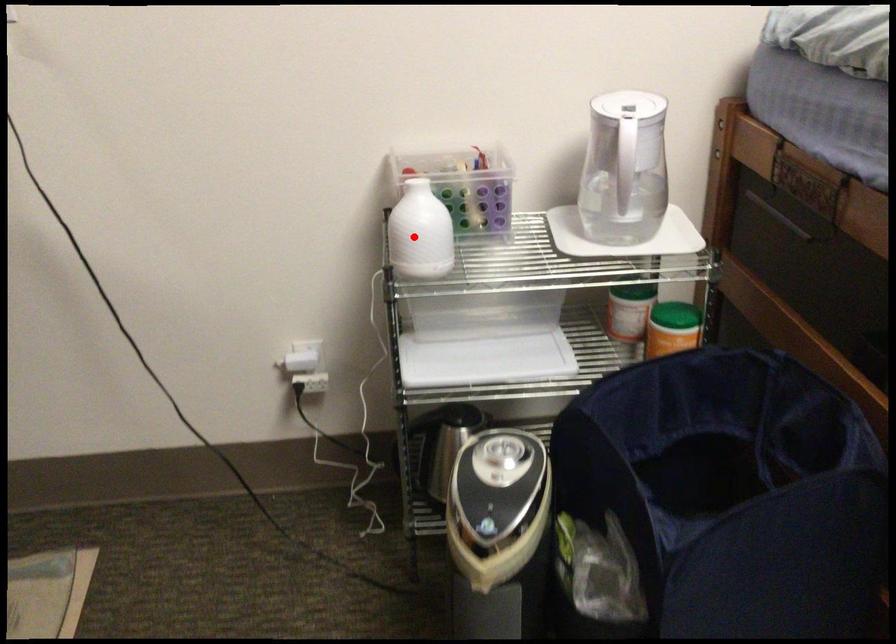
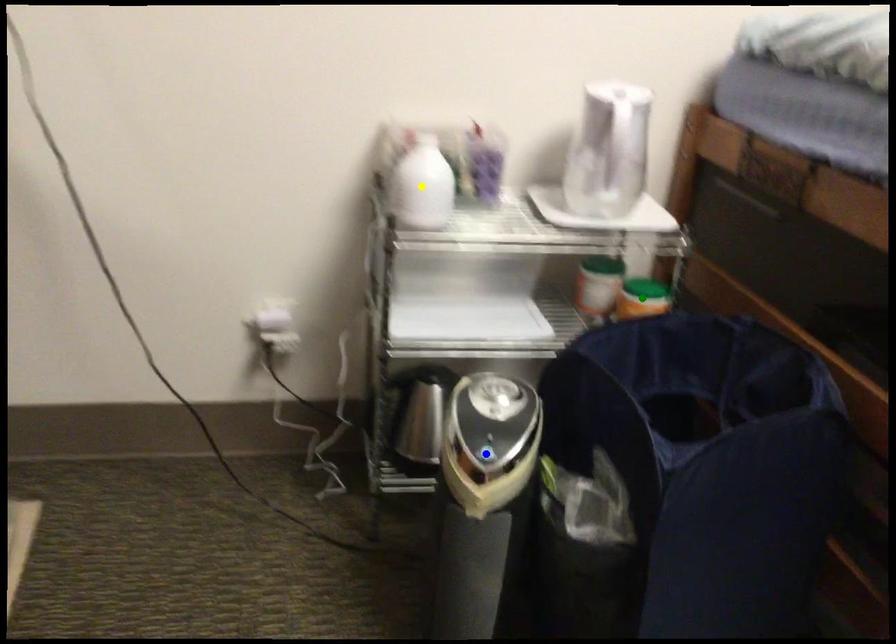
Question: I am providing you with two images of the same scene from different viewpoints. A red point is marked on the first image. You are given multiple points on the second image. In image 2, which mark is for the same physical point as the one in image 1?

Choices:
 (A) yellow point
 (B) green point
 (C) blue point

Answer: (A)